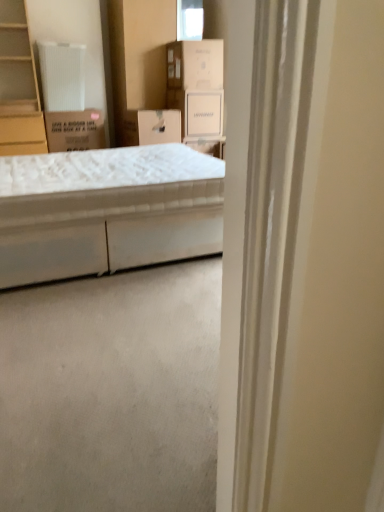
Question: From a real-world perspective, is light brown wood cabinet at left located beneath white cardboard box at upper center, positioned as the first cardboard box in top-to-bottom order?

Choices:
 (A) yes
 (B) no

Answer: (A)

Question: Considering the relative sizes of light brown wood cabinet at left and white cardboard box at upper center, the 1th cardboard box from the right, in the image provided, is light brown wood cabinet at left wider than white cardboard box at upper center, the 1th cardboard box from the right,?

Choices:
 (A) no
 (B) yes

Answer: (B)

Question: Is light brown wood cabinet at left positioned far away from white cardboard box at upper center, the 2th cardboard box in the bottom-to-top sequence?

Choices:
 (A) yes
 (B) no

Answer: (A)

Question: Is light brown wood cabinet at left next to white cardboard box at upper center, the 2th cardboard box in the bottom-to-top sequence, and touching it?

Choices:
 (A) no
 (B) yes

Answer: (A)

Question: From the image's perspective, is light brown wood cabinet at left over white cardboard box at upper center, the 1th cardboard box from the right?

Choices:
 (A) yes
 (B) no

Answer: (B)

Question: Considering the relative positions of light brown wood cabinet at left and white cardboard box at upper center, the 1th cardboard box from the right, in the image provided, is light brown wood cabinet at left to the left of white cardboard box at upper center, the 1th cardboard box from the right, from the viewer's perspective?

Choices:
 (A) yes
 (B) no

Answer: (A)

Question: Is white cardboard box at upper center, which is the 2th cardboard box in left-to-right order, at the left side of white cardboard box at upper center, which appears as the 1th storage box when viewed from the right?

Choices:
 (A) no
 (B) yes

Answer: (B)

Question: Considering the relative sizes of white cardboard box at upper center, the 2th cardboard box in the bottom-to-top sequence, and white cardboard box at upper center, which appears as the 2th storage box when viewed from the left, in the image provided, is white cardboard box at upper center, the 2th cardboard box in the bottom-to-top sequence, taller than white cardboard box at upper center, which appears as the 2th storage box when viewed from the left,?

Choices:
 (A) no
 (B) yes

Answer: (B)

Question: Considering the relative sizes of white cardboard box at upper center, the 1th cardboard box from the right, and white cardboard box at upper center, which appears as the 2th storage box when viewed from the left, in the image provided, is white cardboard box at upper center, the 1th cardboard box from the right, wider than white cardboard box at upper center, which appears as the 2th storage box when viewed from the left,?

Choices:
 (A) yes
 (B) no

Answer: (A)

Question: Is white cardboard box at upper center, the 1th cardboard box from the right, directly adjacent to white cardboard box at upper center, which appears as the 2th storage box when viewed from the left?

Choices:
 (A) yes
 (B) no

Answer: (B)

Question: Does white cardboard box at upper center, which is the 2th cardboard box in left-to-right order, turn towards white cardboard box at upper center, which appears as the 2th storage box when viewed from the left?

Choices:
 (A) no
 (B) yes

Answer: (A)

Question: From a real-world perspective, is white cardboard box at upper center, the 2th cardboard box in the bottom-to-top sequence, on white cardboard box at upper center, which appears as the 2th storage box when viewed from the left?

Choices:
 (A) yes
 (B) no

Answer: (A)

Question: Is brown cardboard box at upper left, the second cardboard box positioned from the top, at the back of white cardboard box at upper center, which appears as the 1th storage box when viewed from the right?

Choices:
 (A) no
 (B) yes

Answer: (A)